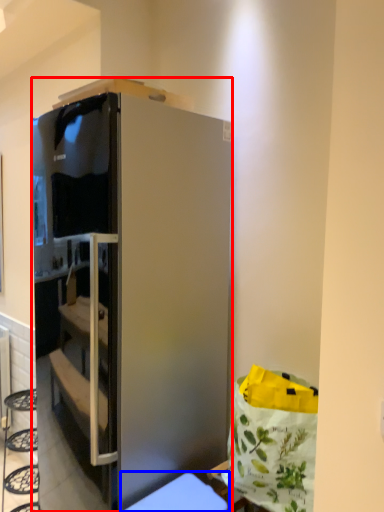
Question: Among these objects, which one is farthest to the camera, cabinetry (highlighted by a red box) or furniture (highlighted by a blue box)?

Choices:
 (A) cabinetry
 (B) furniture

Answer: (A)